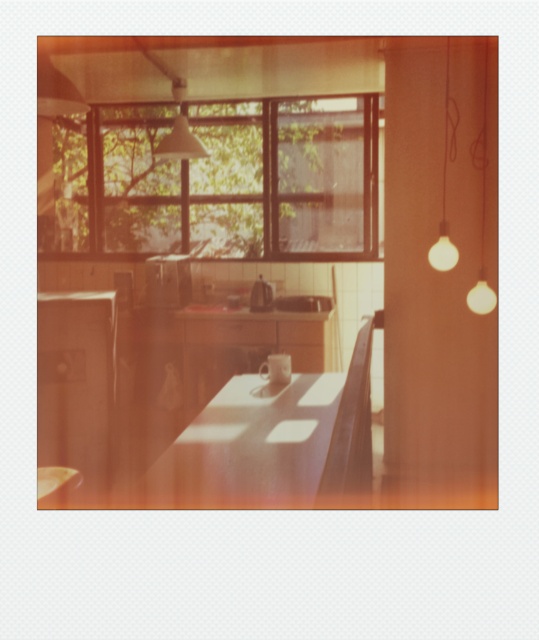
You are arranging a small plant on the white glossy table at center. To ensure it gets enough sunlight, where should you place it relative to the transparent glass window at upper center?

The transparent glass window at upper center is positioned over the white glossy table at center, so placing the plant directly under the window would ensure it receives adequate sunlight.

You are a guest entering the kitchen and want to place a small vase on the closest available surface to the window. Which object between the white glossy table at center and the matte white bulb at upper right should you choose?

The white glossy table at center is closer to the window than the matte white bulb at upper right because it is in front of it, so you should place the vase on the white glossy table at center.

You are arranging decorations in the kitchen and want to place a new vase between the transparent glass window at upper center and the matte white lampshade at upper center. Given that the vase is 30 cm wide, can you fit it between them without overlapping either object?

The transparent glass window at upper center is wider than the matte white lampshade at upper center. Since the window is wider, there might be enough space between them to fit the 30 cm vase. However, the exact distance isn not provided, so it depends on the available space between their edges.